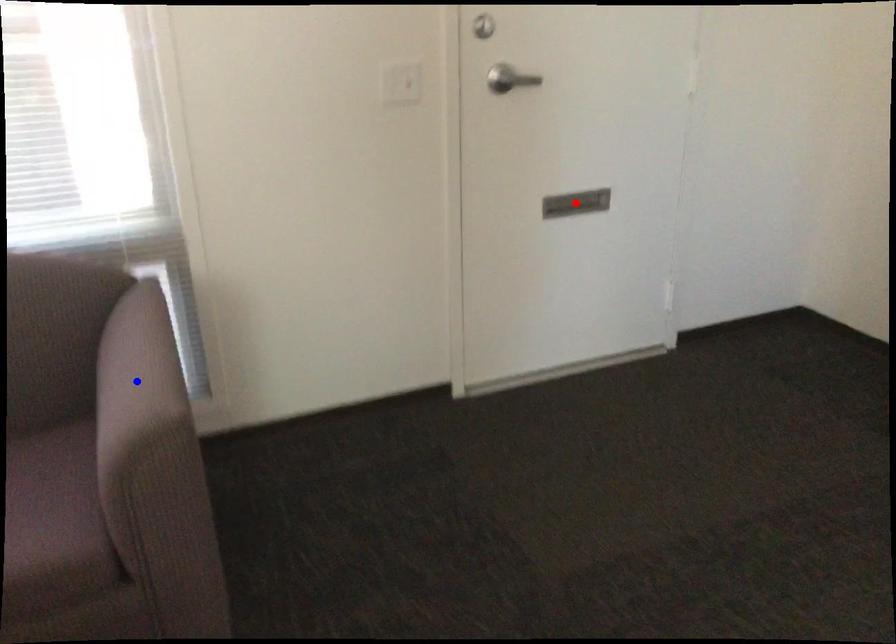
Question: Which of the two points in the image is closer to the camera?

Choices:
 (A) Blue point is closer.
 (B) Red point is closer.

Answer: (A)